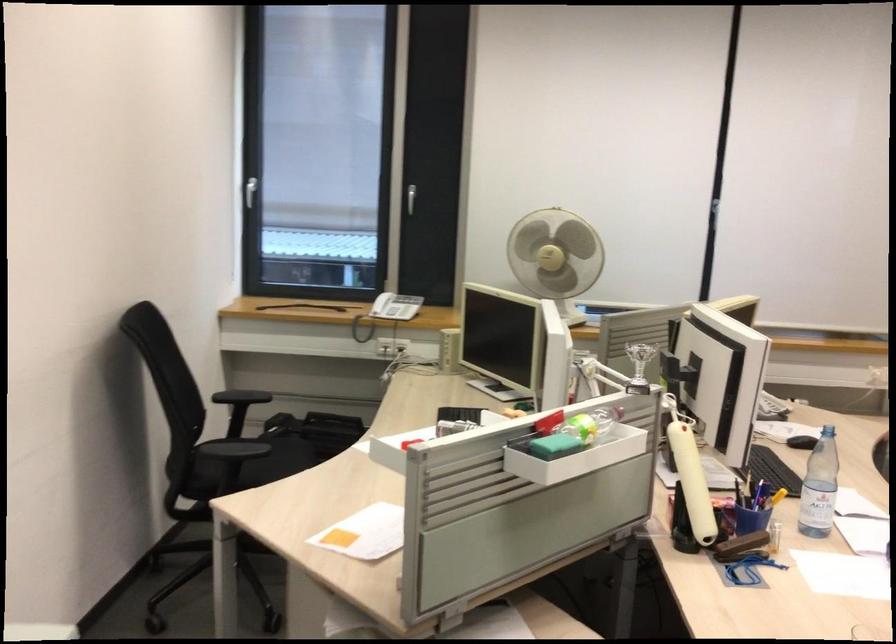
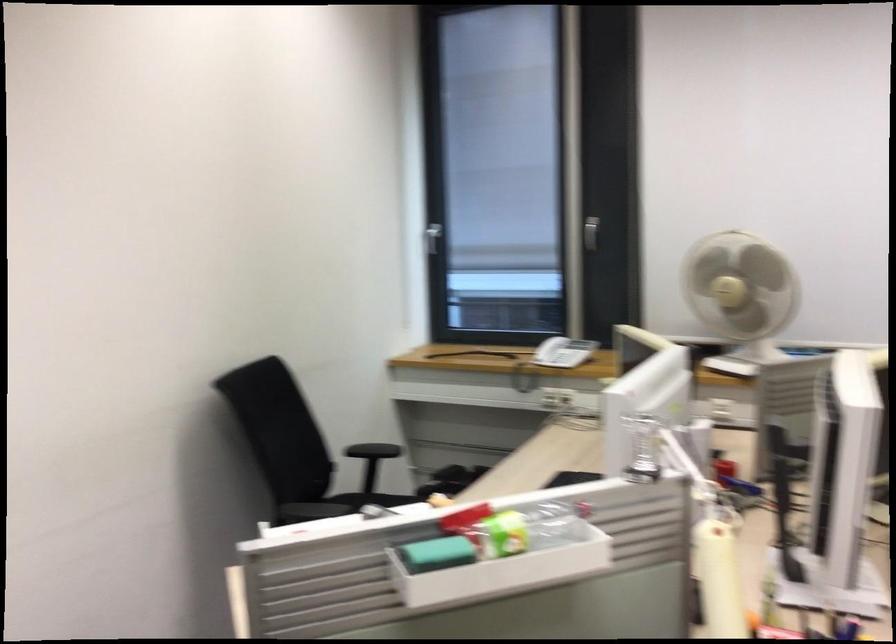
Question: I am providing you with two images of the same scene from different viewpoints. After the viewpoint changes to image2, which objects are now occluded?

Choices:
 (A) black chair armrest
 (B) small silver trophy
 (C) chair sitting surface
 (D) square coaster

Answer: (C)